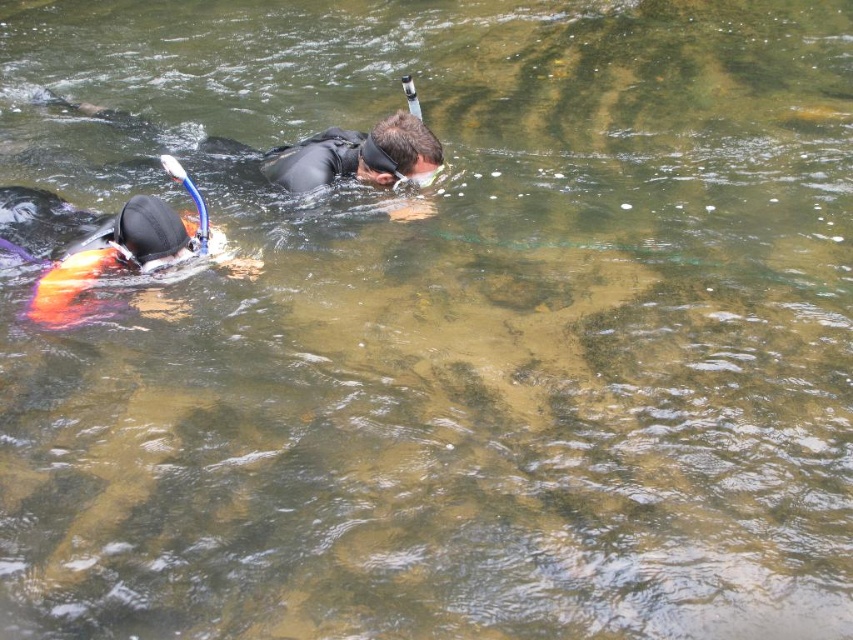
Between black matte wetsuit at center and orange life vest at left, which one appears on the left side from the viewer's perspective?

orange life vest at left

Between black matte wetsuit at center and orange life vest at left, which one is positioned higher?

black matte wetsuit at center

Image resolution: width=853 pixels, height=640 pixels. Find the location of `black matte wetsuit at center`. black matte wetsuit at center is located at coordinates (345, 156).

This screenshot has width=853, height=640. Find the location of `black matte wetsuit at center`. black matte wetsuit at center is located at coordinates (345, 156).